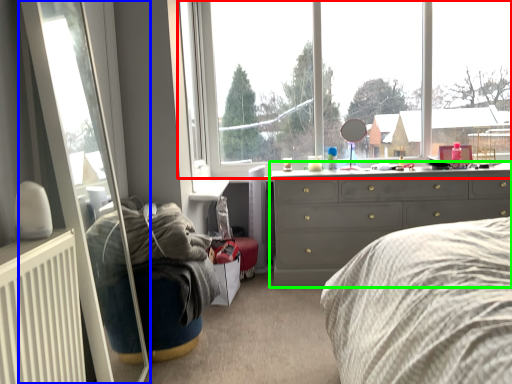
Question: Which object is the closest to the window (highlighted by a red box)? Choose among these: glass door (highlighted by a blue box) or chest of drawers (highlighted by a green box).

Choices:
 (A) glass door
 (B) chest of drawers

Answer: (B)